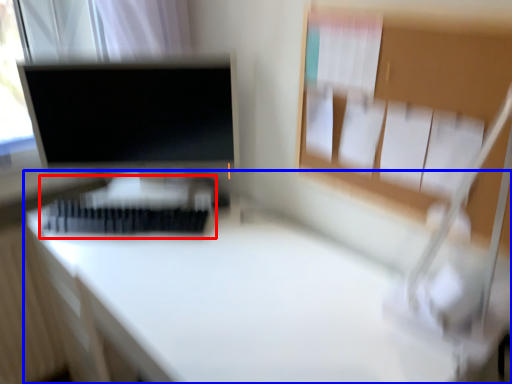
Question: Among these objects, which one is farthest to the camera, bed (highlighted by a red box) or desk (highlighted by a blue box)?

Choices:
 (A) bed
 (B) desk

Answer: (A)